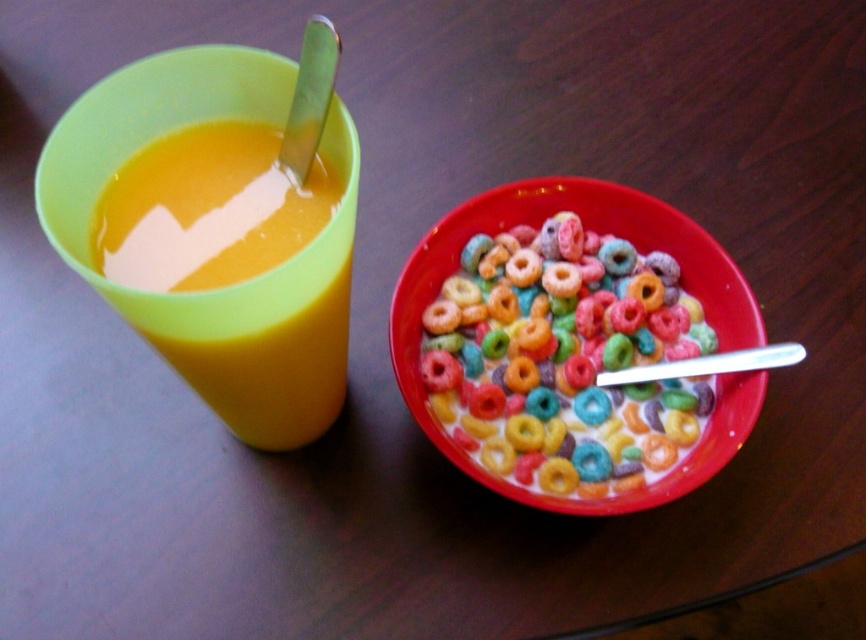
You are a child who wants to reach for the multicolored plastic cereal at center and the translucent plastic cup at left. If your hand can only stretch 10 inches, can you grab both items without moving your arm?

The multicolored plastic cereal at center and the translucent plastic cup at left are 9.63 inches apart from each other. Since your hand can stretch 10 inches, you can reach both items without moving your arm.